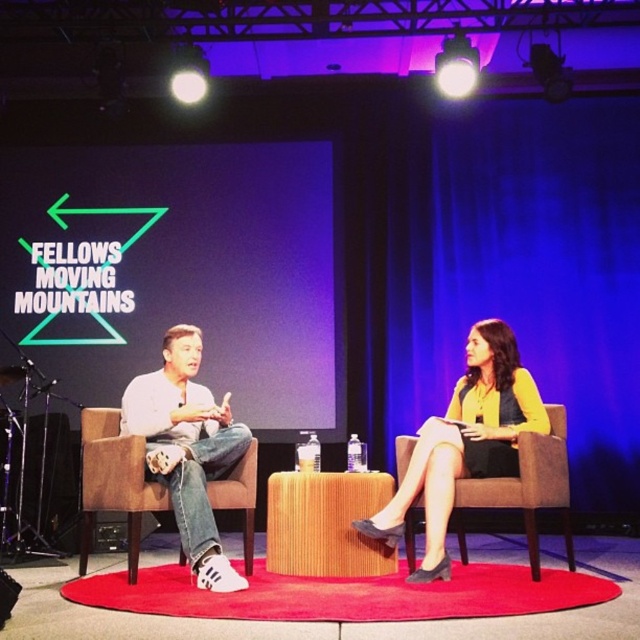
You are setting up a small event and need to place a 1.2 meter wide banner between the brown fabric chair at center and the matte black speaker at left. Based on the scene description, will the space between them accommodate the banner?

The brown fabric chair at center might be wider than matte black speaker at left, so the space between them may not be sufficient to fit a 1.2 meter wide banner. It is recommended to measure the actual distance before placing the banner.

You are a photographer adjusting your camera to focus on two specific points in the stage setup. The first point is at coordinates point (333, 541) and the second is at point (557, 493). Which of these two points will appear closer to your camera lens when you look through the viewfinder?

Point (333, 541) is closer to the camera than point (557, 493), so it will appear closer to the camera lens when viewed through the viewfinder.